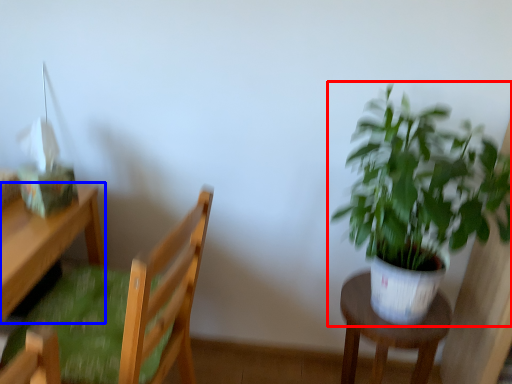
Question: Among these objects, which one is nearest to the camera, houseplant (highlighted by a red box) or desk (highlighted by a blue box)?

Choices:
 (A) houseplant
 (B) desk

Answer: (A)